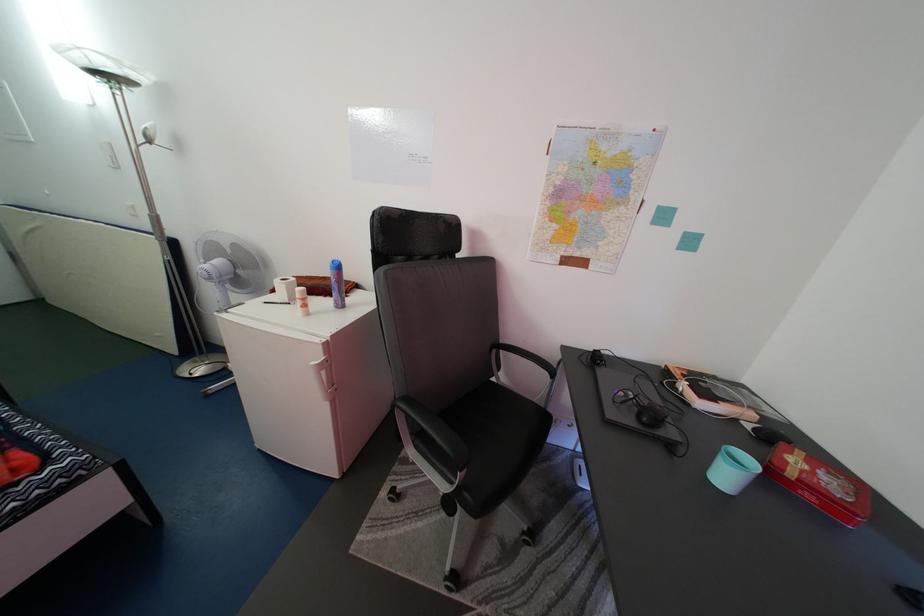
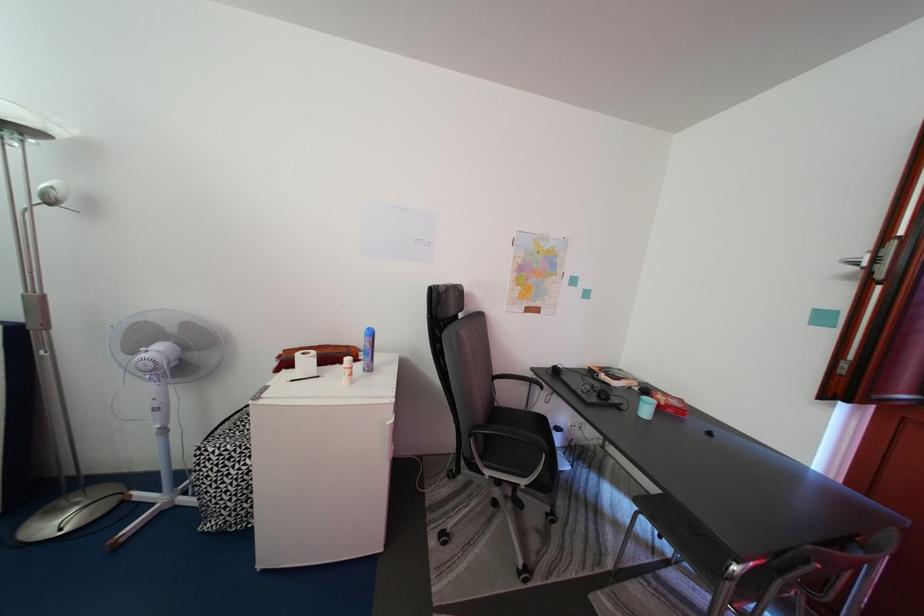
Question: Which direction would the cameraman need to move to produce the second image? Reply with the corresponding letter.

Choices:
 (A) Left
 (B) Right
 (C) Forward
 (D) Backward

Answer: (A)